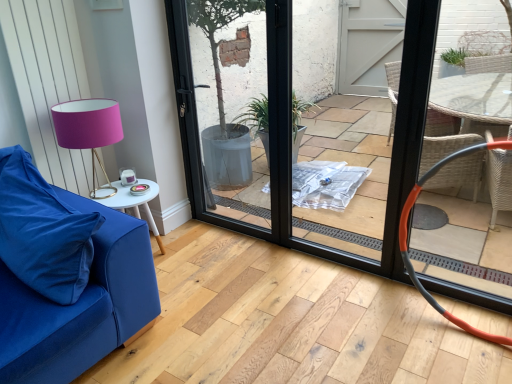
Where is `matte gold table lamp at left`? matte gold table lamp at left is located at coordinates (89, 131).

Image resolution: width=512 pixels, height=384 pixels. Identify the location of velvety blue pillow at lower left. (42, 231).

Is white glossy side table at lower left facing towards matte gold table lamp at left?

No, white glossy side table at lower left is not facing towards matte gold table lamp at left.

Where is `table lamp above the white glossy side table at lower left (from the image's perspective)`? table lamp above the white glossy side table at lower left (from the image's perspective) is located at coordinates (89, 131).

Based on the photo, can you confirm if white glossy side table at lower left is bigger than matte gold table lamp at left?

No, white glossy side table at lower left is not bigger than matte gold table lamp at left.

Is white glossy side table at lower left taller than matte gold table lamp at left?

No.

Would you say orange rubber armchair at right is inside or outside matte gold table lamp at left?

The correct answer is: outside.

From a real-world perspective, does orange rubber armchair at right sit lower than matte gold table lamp at left?

Yes, from a real-world perspective, orange rubber armchair at right is under matte gold table lamp at left.

Which of these two, orange rubber armchair at right or matte gold table lamp at left, is smaller?

With smaller size is matte gold table lamp at left.

Can you confirm if orange rubber armchair at right is positioned to the right of matte gold table lamp at left?

Yes, orange rubber armchair at right is to the right of matte gold table lamp at left.

Is matte gold table lamp at left bigger than white glossy side table at lower left?

Indeed, matte gold table lamp at left has a larger size compared to white glossy side table at lower left.

Based on the photo, from a real-world perspective, is matte gold table lamp at left physically located above or below white glossy side table at lower left?

matte gold table lamp at left is situated higher than white glossy side table at lower left in the real world.

Is matte gold table lamp at left in front of or behind white glossy side table at lower left in the image?

Visually, matte gold table lamp at left is located in front of white glossy side table at lower left.

Between matte gold table lamp at left and white glossy side table at lower left, which one appears on the right side from the viewer's perspective?

From the viewer's perspective, white glossy side table at lower left appears more on the right side.

Is velvety blue pillow at lower left not near orange rubber armchair at right?

Yes, velvety blue pillow at lower left is far from orange rubber armchair at right.

Considering the points (95, 212) and (503, 144), which point is behind, point (95, 212) or point (503, 144)?

The point (503, 144) is more distant.

Is velvety blue pillow at lower left oriented towards orange rubber armchair at right?

No, velvety blue pillow at lower left is not turned towards orange rubber armchair at right.

Is velvety blue pillow at lower left surrounding orange rubber armchair at right?

No, orange rubber armchair at right is not a part of velvety blue pillow at lower left.

From the image's perspective, which object appears higher, orange rubber armchair at right or black glass door at center?

black glass door at center appears higher in the image.

Is orange rubber armchair at right further to camera compared to black glass door at center?

Yes, orange rubber armchair at right is further from the camera.

Is orange rubber armchair at right smaller than black glass door at center?

Yes, orange rubber armchair at right is smaller than black glass door at center.

How different are the orientations of white glossy side table at lower left and velvety blue pillow at lower left in degrees?

white glossy side table at lower left and velvety blue pillow at lower left are facing 93.4 degrees away from each other.

Is white glossy side table at lower left in front of velvety blue pillow at lower left?

No, it is behind velvety blue pillow at lower left.

From a real-world perspective, is white glossy side table at lower left on velvety blue pillow at lower left?

No, from a real-world perspective, white glossy side table at lower left is not over velvety blue pillow at lower left

Considering the sizes of objects white glossy side table at lower left and velvety blue pillow at lower left in the image provided, who is shorter, white glossy side table at lower left or velvety blue pillow at lower left?

With less height is white glossy side table at lower left.

Is orange rubber armchair at right positioned in front of white glossy side table at lower left?

That is True.

Would you say orange rubber armchair at right is a long distance from white glossy side table at lower left?

orange rubber armchair at right is positioned a significant distance from white glossy side table at lower left.

Is orange rubber armchair at right to the right of white glossy side table at lower left from the viewer's perspective?

Indeed, orange rubber armchair at right is positioned on the right side of white glossy side table at lower left.

The height and width of the screenshot is (384, 512). I want to click on table lamp to the left of white glossy side table at lower left, so (89, 131).

The height and width of the screenshot is (384, 512). I want to click on armchair on the right of matte gold table lamp at left, so click(x=407, y=235).

Estimate the real-world distances between objects in this image. Which object is further from matte gold table lamp at left, orange rubber armchair at right or black glass door at center?

Based on the image, orange rubber armchair at right appears to be further to matte gold table lamp at left.

Estimate the real-world distances between objects in this image. Which object is closer to velvety blue pillow at lower left, black glass door at center or orange rubber armchair at right?

Among the two, black glass door at center is located nearer to velvety blue pillow at lower left.

From the image, which object appears to be nearer to white glossy side table at lower left, black glass door at center or matte gold table lamp at left?

The object closer to white glossy side table at lower left is matte gold table lamp at left.

From the image, which object appears to be nearer to velvety blue pillow at lower left, black glass door at center or matte gold table lamp at left?

matte gold table lamp at left is positioned closer to the anchor velvety blue pillow at lower left.

When comparing their distances from black glass door at center, does velvety blue pillow at lower left or white glossy side table at lower left seem closer?

Based on the image, white glossy side table at lower left appears to be nearer to black glass door at center.

Which object lies further to the anchor point orange rubber armchair at right, white glossy side table at lower left or matte gold table lamp at left?

The object further to orange rubber armchair at right is matte gold table lamp at left.

Looking at this image, estimate the real-world distances between objects in this image. Which object is further from black glass door at center, matte gold table lamp at left or white glossy side table at lower left?

matte gold table lamp at left is positioned further to the anchor black glass door at center.

Considering their positions, is matte gold table lamp at left positioned further to black glass door at center than velvety blue pillow at lower left?

velvety blue pillow at lower left is further to black glass door at center.

Locate an element on the screen. Image resolution: width=512 pixels, height=384 pixels. door between velvety blue pillow at lower left and orange rubber armchair at right from left to right is located at coordinates (x=288, y=128).

Where is `door between white glossy side table at lower left and orange rubber armchair at right`? door between white glossy side table at lower left and orange rubber armchair at right is located at coordinates (288, 128).

I want to click on door located between matte gold table lamp at left and orange rubber armchair at right in the left-right direction, so click(288, 128).

Where is `table between velvety blue pillow at lower left and black glass door at center in the horizontal direction`? The height and width of the screenshot is (384, 512). table between velvety blue pillow at lower left and black glass door at center in the horizontal direction is located at coordinates (135, 203).